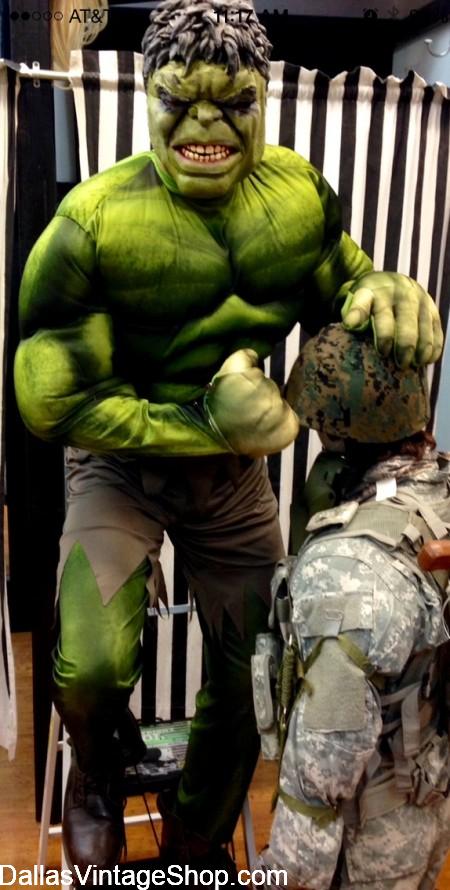
Locate an element on the screen. hardwood floor is located at coordinates (15, 845).